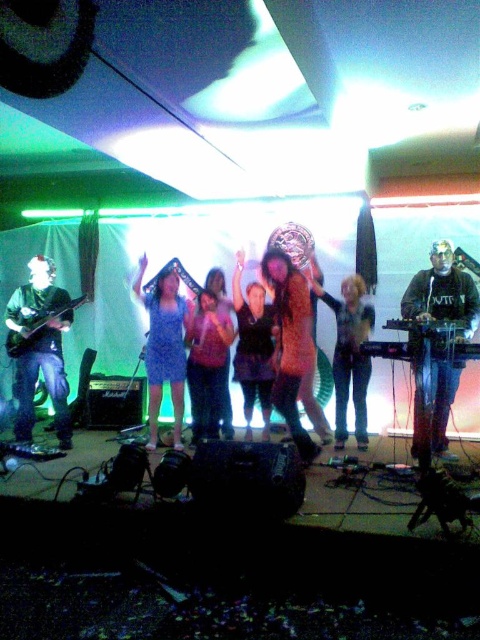
You are a stagehand who needs to place a microphone stand exactly 0.1 units to the right of the black matte keyboard at center. What are the coordinates where you should position the microphone stand?

The black matte keyboard at center is located at coordinates point (443, 292). Adding 0.1 to the x coordinate gives 0.559, so the microphone stand should be placed at point (443, 356).

You are a stagehand who needs to place a microphone stand exactly 0.2 units to the right of the matte black guitar at left. What are the coordinates where you should place the microphone stand?

The matte black guitar at left is located at coordinates point (38, 348). Adding 0.2 units to the x coordinate gives 0.745. The microphone stand should be placed at point (38, 476).